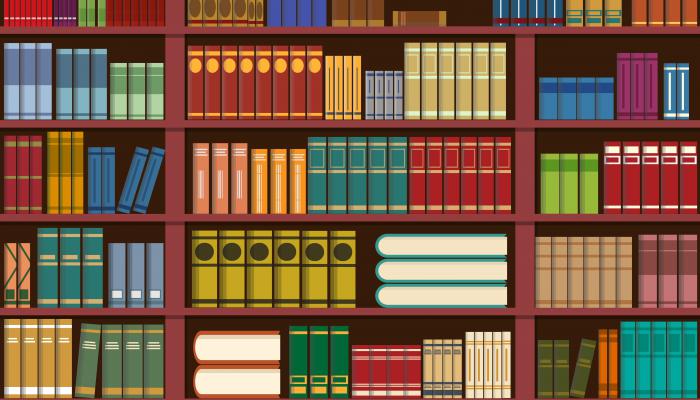
You are a GUI agent. You are given a task and a screenshot of the screen. Output one action in this format:
    pyautogui.click(x=<x>, y=<y>)
    Task: Click on the books lying on their side
    Image resolution: width=700 pixels, height=400 pixels.
    Given the screenshot: What is the action you would take?
    pyautogui.click(x=433, y=16), pyautogui.click(x=435, y=247), pyautogui.click(x=435, y=268), pyautogui.click(x=428, y=304), pyautogui.click(x=232, y=349), pyautogui.click(x=232, y=375)